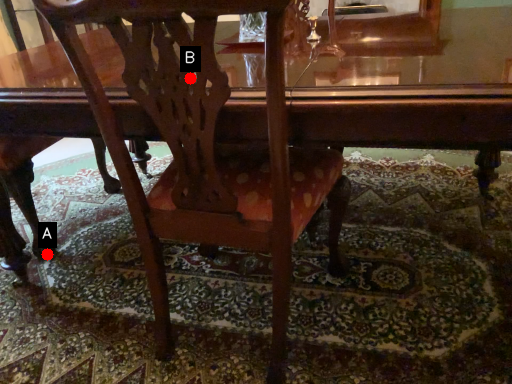
Question: Two points are circled on the image, labeled by A and B beside each circle. Which point is farther from the camera taking this photo?

Choices:
 (A) A is further
 (B) B is further

Answer: (A)